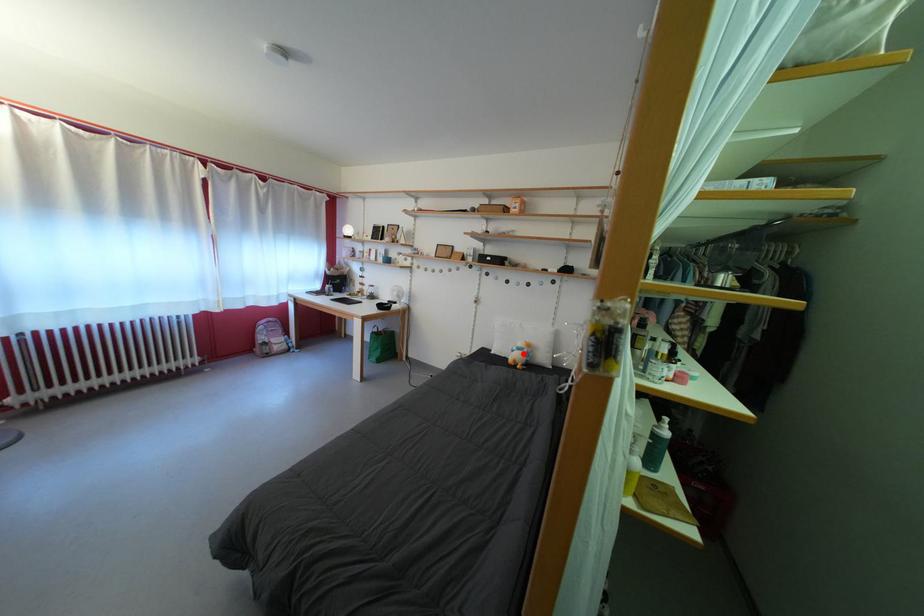
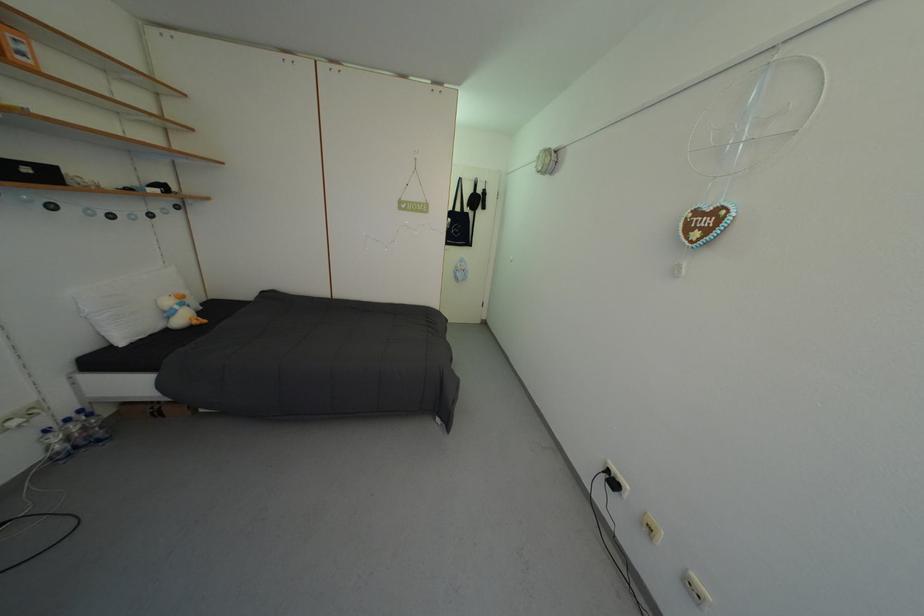
Locate, in the second image, the point that corresponds to the highlighted location in the first image.

(186, 313)